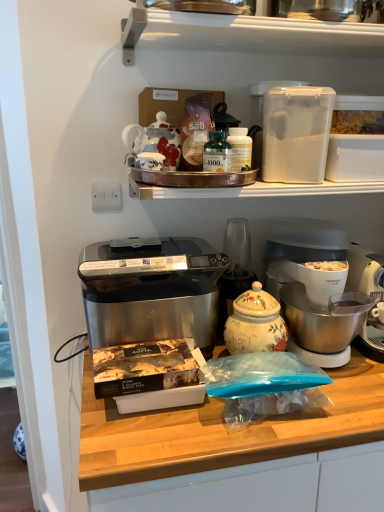
Question: From the image's perspective, is decorative ceramic jar at center located above stainless steel appliance at center?

Choices:
 (A) yes
 (B) no

Answer: (A)

Question: Are decorative ceramic jar at center and stainless steel appliance at center beside each other?

Choices:
 (A) yes
 (B) no

Answer: (B)

Question: From a real-world perspective, does decorative ceramic jar at center stand above stainless steel appliance at center?

Choices:
 (A) no
 (B) yes

Answer: (B)

Question: Does decorative ceramic jar at center turn towards stainless steel appliance at center?

Choices:
 (A) yes
 (B) no

Answer: (B)

Question: From a real-world perspective, is decorative ceramic jar at center beneath stainless steel appliance at center?

Choices:
 (A) yes
 (B) no

Answer: (B)

Question: Does decorative ceramic jar at center appear on the left side of stainless steel appliance at center?

Choices:
 (A) yes
 (B) no

Answer: (A)

Question: Is the depth of stainless steel appliance at center less than that of decorative ceramic jar at center?

Choices:
 (A) no
 (B) yes

Answer: (B)

Question: Is stainless steel appliance at center bigger than decorative ceramic jar at center?

Choices:
 (A) yes
 (B) no

Answer: (A)

Question: Can you confirm if stainless steel appliance at center is positioned to the right of decorative ceramic jar at center?

Choices:
 (A) no
 (B) yes

Answer: (B)

Question: Does stainless steel appliance at center have a greater height compared to decorative ceramic jar at center?

Choices:
 (A) no
 (B) yes

Answer: (B)

Question: Considering the relative sizes of stainless steel appliance at center and decorative ceramic jar at center in the image provided, is stainless steel appliance at center smaller than decorative ceramic jar at center?

Choices:
 (A) yes
 (B) no

Answer: (B)

Question: Is stainless steel appliance at center not close to decorative ceramic jar at center?

Choices:
 (A) yes
 (B) no

Answer: (B)

Question: Is porcelain teapot at upper center, marked as the second appliance in a right-to-left arrangement, thinner than satin black toaster oven at center?

Choices:
 (A) yes
 (B) no

Answer: (A)